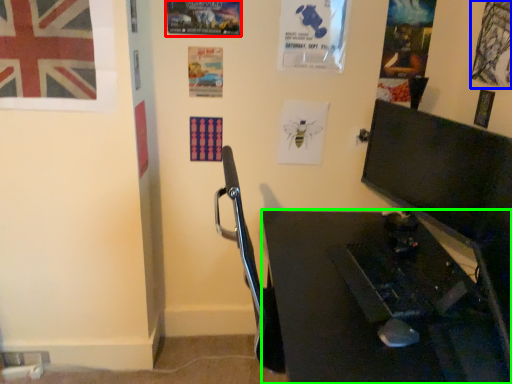
Question: Which object is positioned closest to poster page (highlighted by a red box)? Select from poster page (highlighted by a blue box) and desk (highlighted by a green box).

Choices:
 (A) poster page
 (B) desk

Answer: (A)